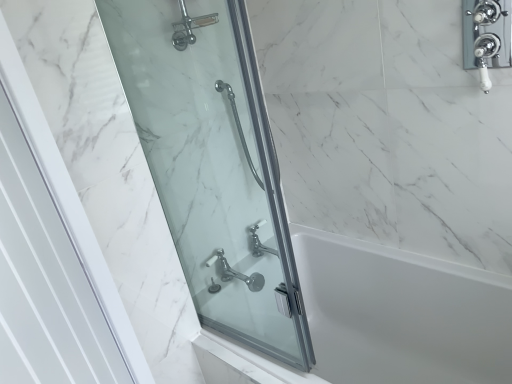
Question: Is polished chrome faucet at lower center oriented away from white glossy bathtub at center?

Choices:
 (A) yes
 (B) no

Answer: (B)

Question: Can you confirm if polished chrome faucet at lower center is shorter than white glossy bathtub at center?

Choices:
 (A) yes
 (B) no

Answer: (A)

Question: Is polished chrome faucet at lower center with white glossy bathtub at center?

Choices:
 (A) no
 (B) yes

Answer: (A)

Question: Considering the relative sizes of polished chrome faucet at lower center and white glossy bathtub at center in the image provided, is polished chrome faucet at lower center taller than white glossy bathtub at center?

Choices:
 (A) yes
 (B) no

Answer: (B)

Question: Would you consider polished chrome faucet at lower center to be distant from white glossy bathtub at center?

Choices:
 (A) yes
 (B) no

Answer: (B)

Question: Considering the relative sizes of polished chrome faucet at lower center and white glossy bathtub at center in the image provided, is polished chrome faucet at lower center bigger than white glossy bathtub at center?

Choices:
 (A) no
 (B) yes

Answer: (A)

Question: Is the position of white glossy door at left, which is counted as the second screen door, starting from the back, more distant than that of clear glass shower door at left, the 1th screen door from the back?

Choices:
 (A) no
 (B) yes

Answer: (A)

Question: From the image's perspective, would you say white glossy door at left, which is counted as the second screen door, starting from the back, is positioned over clear glass shower door at left, the 1th screen door from the back?

Choices:
 (A) no
 (B) yes

Answer: (A)

Question: Can you confirm if white glossy door at left, which is the first screen door from front to back, is bigger than clear glass shower door at left, which appears as the 2th screen door when viewed from the front?

Choices:
 (A) yes
 (B) no

Answer: (A)

Question: Considering the relative sizes of white glossy door at left, which is the first screen door from front to back, and clear glass shower door at left, the 1th screen door from the back, in the image provided, is white glossy door at left, which is the first screen door from front to back, smaller than clear glass shower door at left, the 1th screen door from the back,?

Choices:
 (A) yes
 (B) no

Answer: (B)

Question: From a real-world perspective, is white glossy door at left, which is counted as the second screen door, starting from the back, physically above clear glass shower door at left, which appears as the 2th screen door when viewed from the front?

Choices:
 (A) yes
 (B) no

Answer: (B)

Question: Can clear glass shower door at left, the 1th screen door from the back, be found inside white glossy door at left, which is the first screen door from front to back?

Choices:
 (A) yes
 (B) no

Answer: (B)

Question: Can you confirm if clear glass shower door at left, which appears as the 2th screen door when viewed from the front, is shorter than white glossy door at left, which is counted as the second screen door, starting from the back?

Choices:
 (A) yes
 (B) no

Answer: (A)